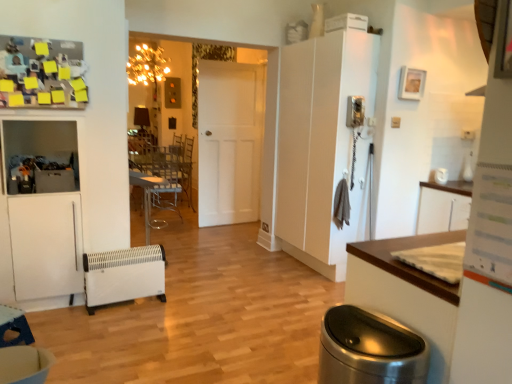
Question: Considering the positions of clear plastic chair at center and metallic silver table at center, the 2th table in the left-to-right sequence, in the image, is clear plastic chair at center taller or shorter than metallic silver table at center, the 2th table in the left-to-right sequence,?

Choices:
 (A) short
 (B) tall

Answer: (B)

Question: From a real-world perspective, is clear plastic chair at center positioned above or below metallic silver table at center, arranged as the first table when viewed from the right?

Choices:
 (A) above
 (B) below

Answer: (A)

Question: Which object is positioned closest to the white matte heater at lower left?

Choices:
 (A) white matte cabinet at right
 (B) white matte door at center
 (C) metallic silver table at center, arranged as the 2th table when ordered from the bottom
 (D) wooden table at lower left, placed as the 1th table when sorted from bottom to top
 (E) polished stainless steel trash can at lower right

Answer: (D)

Question: Estimate the real-world distances between objects in this image. Which object is closer to the white matte door at center?

Choices:
 (A) clear plastic chair at center
 (B) polished stainless steel trash can at lower right
 (C) metallic silver table at center, arranged as the 2th table when ordered from the bottom
 (D) white matte heater at lower left
 (E) white matte cabinet at right

Answer: (E)